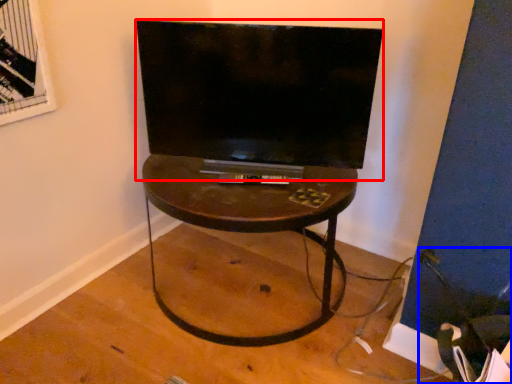
Question: Which object appears closest to the camera in this image, television (highlighted by a red box) or swivel chair (highlighted by a blue box)?

Choices:
 (A) television
 (B) swivel chair

Answer: (B)